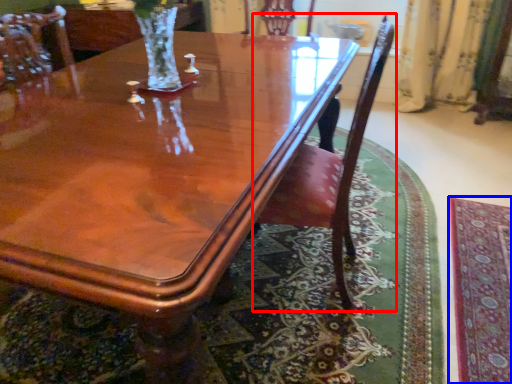
Question: Among these objects, which one is farthest to the camera, chair (highlighted by a red box) or mat (highlighted by a blue box)?

Choices:
 (A) chair
 (B) mat

Answer: (B)